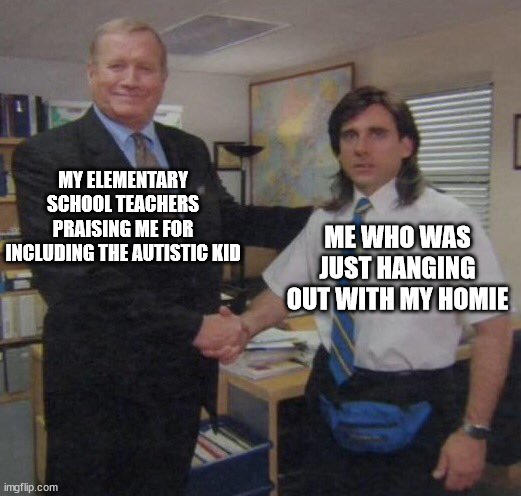
This screenshot has height=496, width=521. I want to click on wooden table, so click(x=289, y=384).